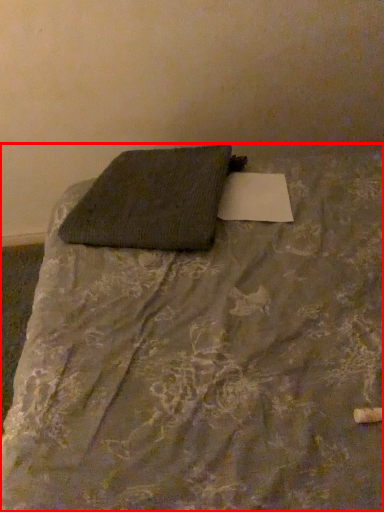
Question: Where is bed (annotated by the red box) located in relation to pillow in the image?

Choices:
 (A) right
 (B) left

Answer: (A)